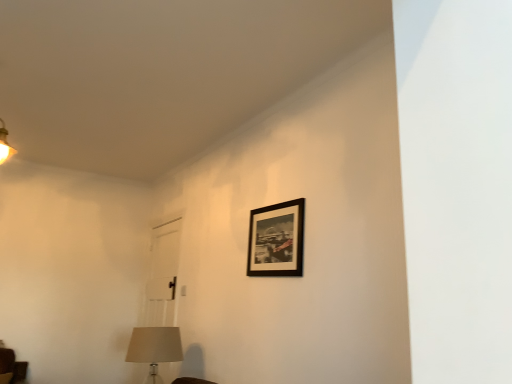
What are the coordinates of `beige fabric lampshade at lower left` in the screenshot? It's located at (154, 348).

Measure the distance between beige fabric lampshade at lower left and camera.

beige fabric lampshade at lower left is 9.32 feet from camera.

What do you see at coordinates (154, 348) in the screenshot? I see `beige fabric lampshade at lower left` at bounding box center [154, 348].

What do you see at coordinates (276, 240) in the screenshot? I see `black matte picture frame at upper center` at bounding box center [276, 240].

Image resolution: width=512 pixels, height=384 pixels. I want to click on black matte picture frame at upper center, so click(x=276, y=240).

This screenshot has width=512, height=384. What are the coordinates of `beige fabric lampshade at lower left` in the screenshot? It's located at (154, 348).

Looking at this image, based on their positions, is beige fabric lampshade at lower left located to the left or right of black matte picture frame at upper center?

Clearly, beige fabric lampshade at lower left is on the left of black matte picture frame at upper center in the image.

Considering the positions of objects beige fabric lampshade at lower left and black matte picture frame at upper center in the image provided, who is in front, beige fabric lampshade at lower left or black matte picture frame at upper center?

black matte picture frame at upper center is closer to the camera.

Is point (129, 356) positioned after point (266, 265)?

Yes, point (129, 356) is behind point (266, 265).

From the image's perspective, which object appears higher, beige fabric lampshade at lower left or black matte picture frame at upper center?

From the image's view, black matte picture frame at upper center is above.

From a real-world perspective, relative to black matte picture frame at upper center, is beige fabric lampshade at lower left vertically above or below?

beige fabric lampshade at lower left is situated lower than black matte picture frame at upper center in the real world.

Can you confirm if beige fabric lampshade at lower left is wider than black matte picture frame at upper center?

Indeed, beige fabric lampshade at lower left has a greater width compared to black matte picture frame at upper center.

Between beige fabric lampshade at lower left and black matte picture frame at upper center, which one has less height?

With less height is black matte picture frame at upper center.

Can you confirm if beige fabric lampshade at lower left is smaller than black matte picture frame at upper center?

No, beige fabric lampshade at lower left is not smaller than black matte picture frame at upper center.

Is black matte picture frame at upper center surrounded by beige fabric lampshade at lower left?

No.

Is the surface of beige fabric lampshade at lower left in direct contact with black matte picture frame at upper center?

No, beige fabric lampshade at lower left is not beside black matte picture frame at upper center.

Could you tell me if beige fabric lampshade at lower left is facing black matte picture frame at upper center?

No.

Can you tell me how much beige fabric lampshade at lower left and black matte picture frame at upper center differ in facing direction?

beige fabric lampshade at lower left and black matte picture frame at upper center are facing 1.95 degrees away from each other.

I want to click on table lamp lying behind the black matte picture frame at upper center, so [154, 348].

Does black matte picture frame at upper center appear on the left side of beige fabric lampshade at lower left?

No.

Who is more distant, black matte picture frame at upper center or beige fabric lampshade at lower left?

beige fabric lampshade at lower left is more distant.

Is point (250, 225) more distant than point (156, 359)?

Yes, it is.

From the image's perspective, which one is positioned lower, black matte picture frame at upper center or beige fabric lampshade at lower left?

beige fabric lampshade at lower left appears lower in the image.

From a real-world perspective, is black matte picture frame at upper center positioned above or below beige fabric lampshade at lower left?

black matte picture frame at upper center is situated higher than beige fabric lampshade at lower left in the real world.

Does black matte picture frame at upper center have a lesser width compared to beige fabric lampshade at lower left?

Yes.

Does black matte picture frame at upper center have a greater height compared to beige fabric lampshade at lower left?

No.

Between black matte picture frame at upper center and beige fabric lampshade at lower left, which one has larger size?

With larger size is beige fabric lampshade at lower left.

Is beige fabric lampshade at lower left surrounded by black matte picture frame at upper center?

Definitely not — beige fabric lampshade at lower left is not inside black matte picture frame at upper center.

Is black matte picture frame at upper center far away from beige fabric lampshade at lower left?

black matte picture frame at upper center is positioned a significant distance from beige fabric lampshade at lower left.

Is black matte picture frame at upper center facing away from beige fabric lampshade at lower left?

No, black matte picture frame at upper center is not facing away from beige fabric lampshade at lower left.

Can you tell me how much black matte picture frame at upper center and beige fabric lampshade at lower left differ in facing direction?

1.95 degrees separate the facing orientations of black matte picture frame at upper center and beige fabric lampshade at lower left.

Could you measure the distance between black matte picture frame at upper center and beige fabric lampshade at lower left?

black matte picture frame at upper center and beige fabric lampshade at lower left are 1.00 meters apart from each other.

This screenshot has height=384, width=512. I want to click on table lamp that appears on the left of black matte picture frame at upper center, so click(x=154, y=348).

This screenshot has height=384, width=512. Identify the location of table lamp below the black matte picture frame at upper center (from a real-world perspective). (154, 348).

You are a GUI agent. You are given a task and a screenshot of the screen. Output one action in this format:
    pyautogui.click(x=<x>, y=<y>)
    Task: Click on the table lamp below the black matte picture frame at upper center (from the image's perspective)
    The height and width of the screenshot is (384, 512).
    Given the screenshot: What is the action you would take?
    pyautogui.click(x=154, y=348)